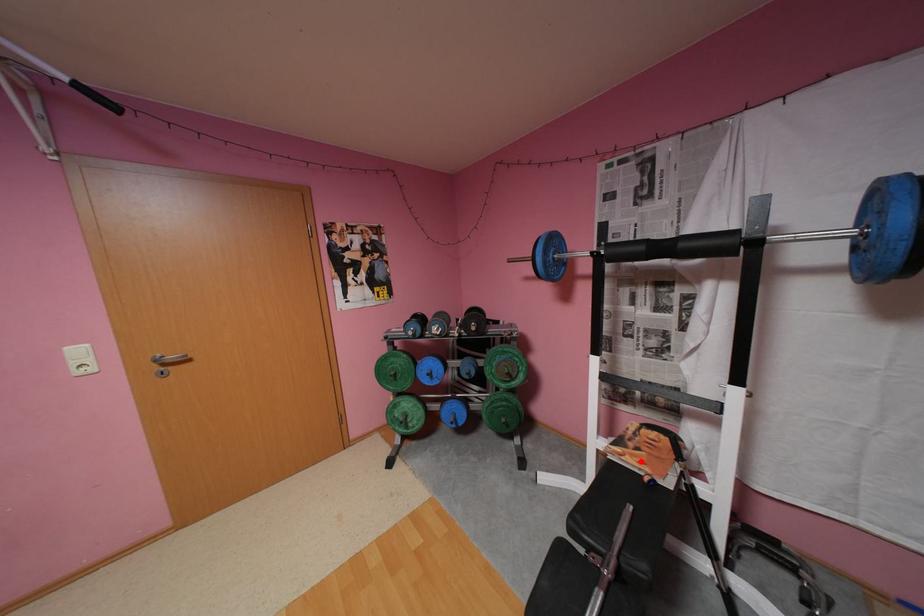
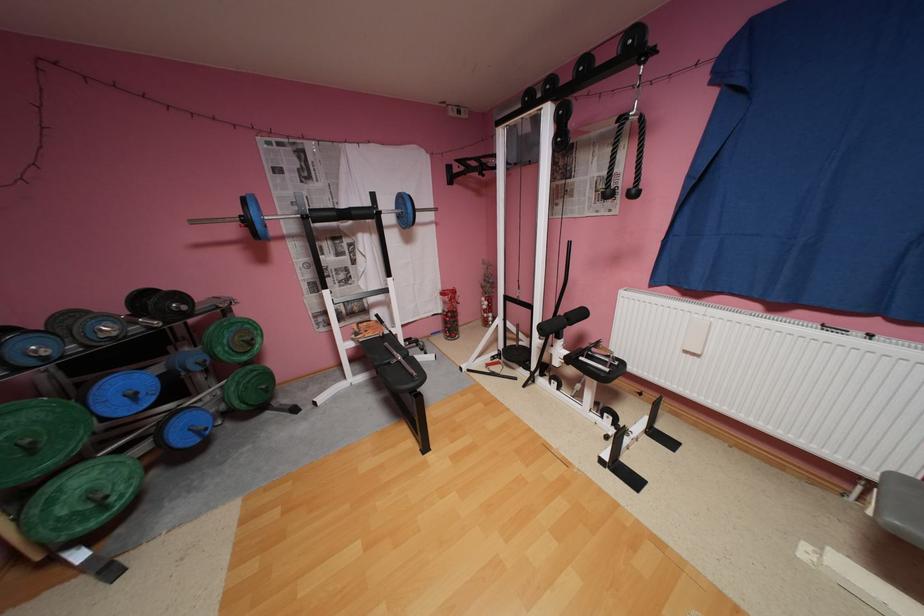
In the second image, find the point that corresponds to the highlighted location in the first image.

(380, 334)